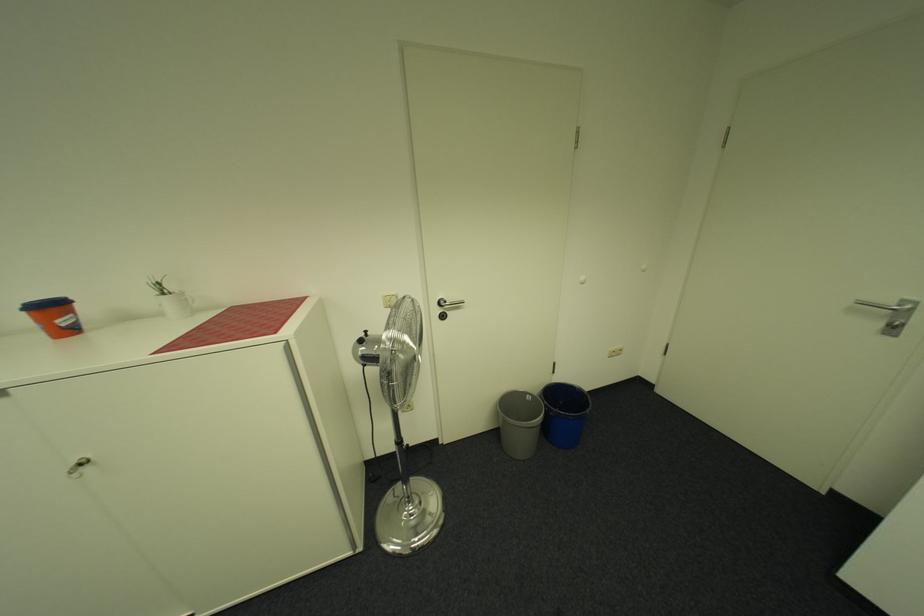
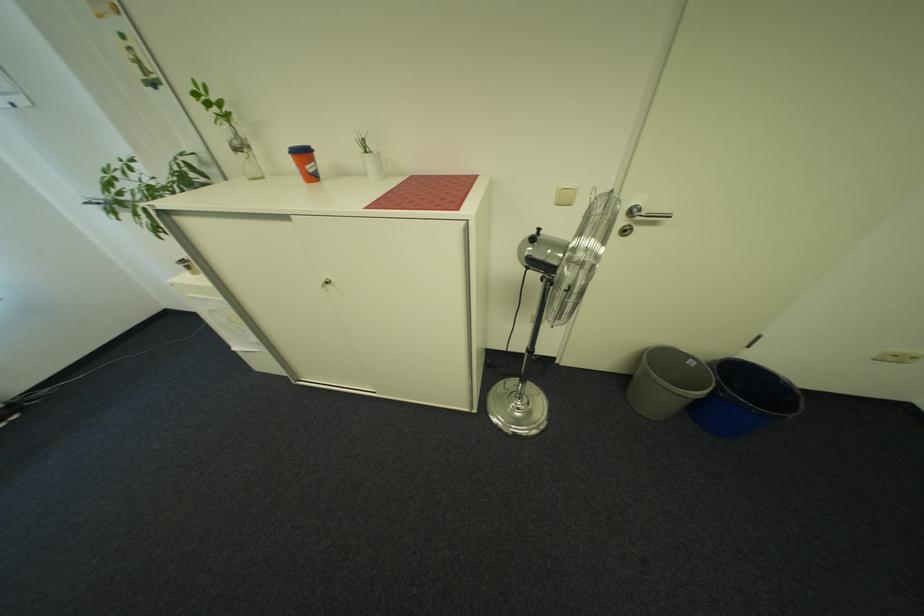
The point at (455, 302) is marked in the first image. Where is the corresponding point in the second image?

(650, 211)